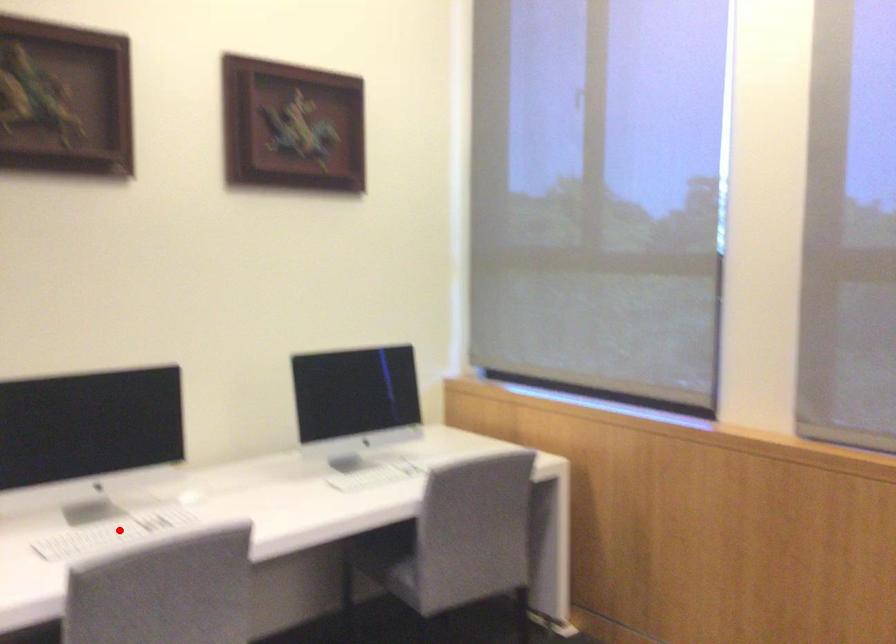
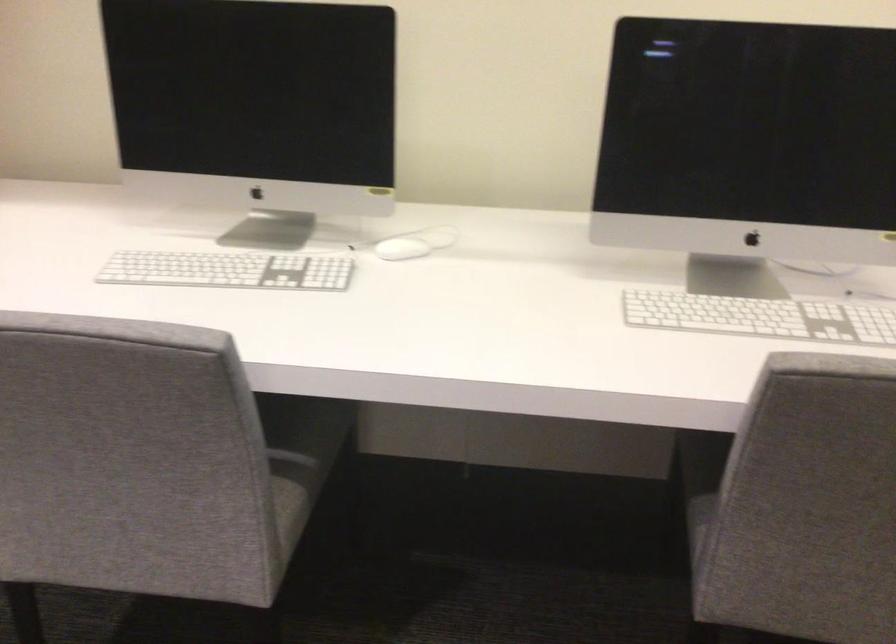
Question: I am providing you with two images of the same scene from different viewpoints. Image1 has a red point marked. In image2, the corresponding 3D location appears at what relative position? Reply with the corresponding letter.

Choices:
 (A) Closer
 (B) Farther

Answer: (A)